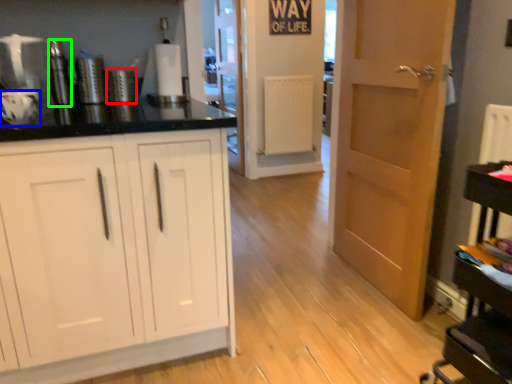
Question: Which object is the closest to the appliance (highlighted by a red box)? Choose among these: appliance (highlighted by a blue box) or appliance (highlighted by a green box).

Choices:
 (A) appliance
 (B) appliance

Answer: (B)